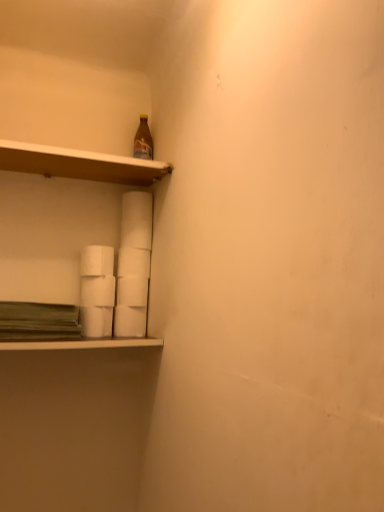
Question: Considering the relative sizes of white matte paper towel at center, the third paper towel viewed from the top, and wooden shelf at upper left in the image provided, is white matte paper towel at center, the third paper towel viewed from the top, bigger than wooden shelf at upper left?

Choices:
 (A) yes
 (B) no

Answer: (B)

Question: Is white matte paper towel at center, marked as the 4th paper towel in a bottom-to-top arrangement, with wooden shelf at upper left?

Choices:
 (A) no
 (B) yes

Answer: (A)

Question: Can you confirm if white matte paper towel at center, the third paper towel viewed from the top, is smaller than wooden shelf at upper left?

Choices:
 (A) yes
 (B) no

Answer: (A)

Question: Is white matte paper towel at center, marked as the 4th paper towel in a bottom-to-top arrangement, wider than wooden shelf at upper left?

Choices:
 (A) yes
 (B) no

Answer: (B)

Question: Considering the relative positions of white matte paper towel at center, the third paper towel viewed from the top, and wooden shelf at upper left in the image provided, is white matte paper towel at center, the third paper towel viewed from the top, to the right of wooden shelf at upper left from the viewer's perspective?

Choices:
 (A) no
 (B) yes

Answer: (B)

Question: Is white matte paper towel at lower left, the 2th paper towel from the bottom, situated inside white matte paper towel at lower left, acting as the 1th paper towel starting from the top, or outside?

Choices:
 (A) inside
 (B) outside

Answer: (B)

Question: From the image's perspective, is white matte paper towel at lower left, the 2th paper towel from the bottom, positioned above or below white matte paper towel at lower left, acting as the 1th paper towel starting from the top?

Choices:
 (A) below
 (B) above

Answer: (A)

Question: Looking at their shapes, would you say white matte paper towel at lower left, positioned as the fifth paper towel in top-to-bottom order, is wider or thinner than white matte paper towel at lower left, which ranks as the 6th paper towel in bottom-to-top order?

Choices:
 (A) wide
 (B) thin

Answer: (A)

Question: From a real-world perspective, is white matte paper towel at lower left, positioned as the fifth paper towel in top-to-bottom order, positioned above or below white matte paper towel at lower left, acting as the 1th paper towel starting from the top?

Choices:
 (A) above
 (B) below

Answer: (B)

Question: From their relative heights in the image, would you say white matte paper towel at center, which is counted as the fifth paper towel, starting from the bottom, is taller or shorter than white matte paper towel at lower center, which is the first paper towel in bottom-to-top order?

Choices:
 (A) short
 (B) tall

Answer: (A)

Question: Based on their sizes in the image, would you say white matte paper towel at center, arranged as the 2th paper towel when viewed from the top, is bigger or smaller than white matte paper towel at lower center, which is the first paper towel in bottom-to-top order?

Choices:
 (A) big
 (B) small

Answer: (B)

Question: Considering the positions of white matte paper towel at center, which is counted as the fifth paper towel, starting from the bottom, and white matte paper towel at lower center, the 6th paper towel from the top, in the image, is white matte paper towel at center, which is counted as the fifth paper towel, starting from the bottom, wider or thinner than white matte paper towel at lower center, the 6th paper towel from the top,?

Choices:
 (A) wide
 (B) thin

Answer: (B)

Question: Is point (142, 258) positioned closer to the camera than point (119, 322)?

Choices:
 (A) closer
 (B) farther

Answer: (B)

Question: Relative to white matte paper towel at lower left, the 2th paper towel from the bottom, is white matte paper towel at center, marked as the 4th paper towel in a bottom-to-top arrangement, in front or behind?

Choices:
 (A) front
 (B) behind

Answer: (B)

Question: From the image's perspective, relative to white matte paper towel at lower left, the 2th paper towel from the bottom, is white matte paper towel at center, marked as the 4th paper towel in a bottom-to-top arrangement, above or below?

Choices:
 (A) below
 (B) above

Answer: (B)